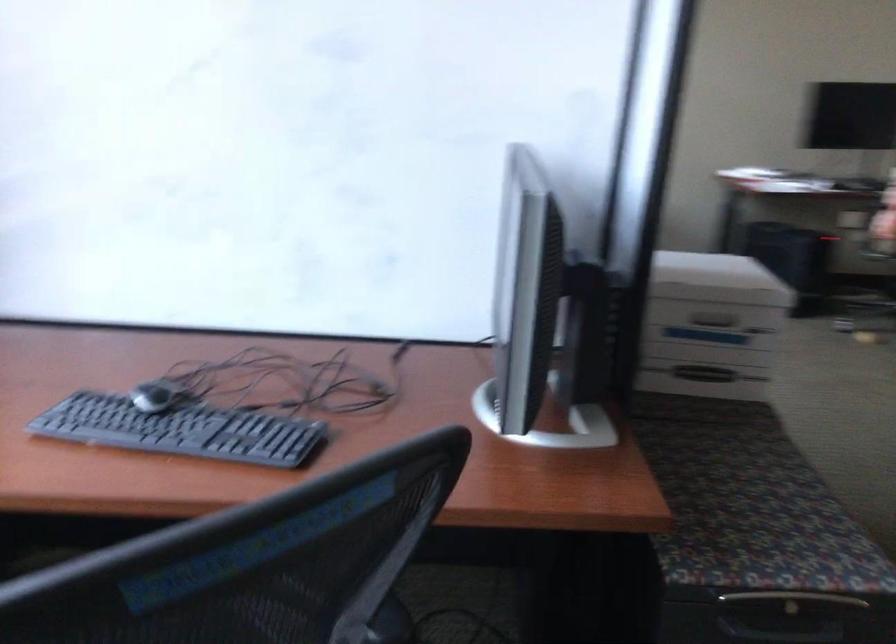
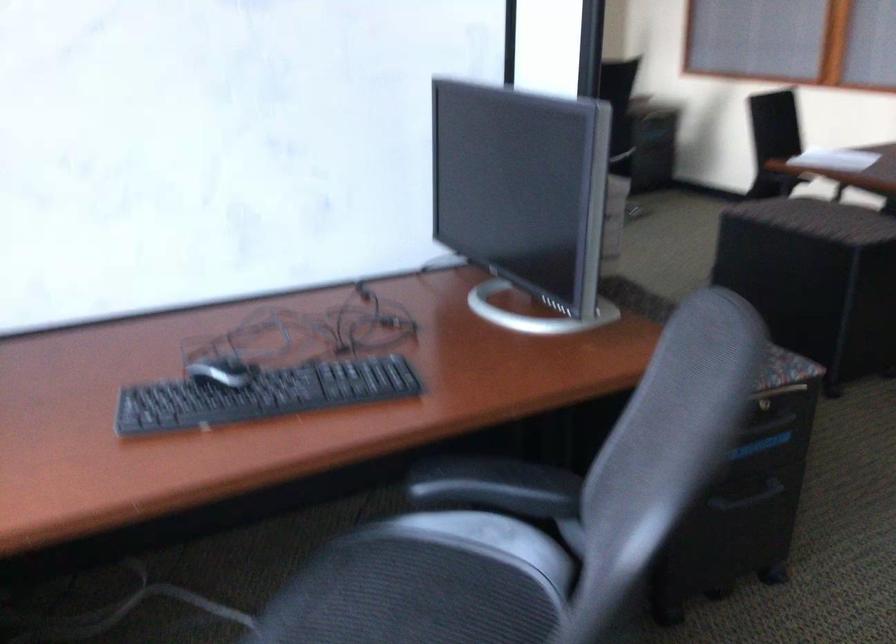
The point at [148,392] is marked in the first image. Where is the corresponding point in the second image?

(220, 371)